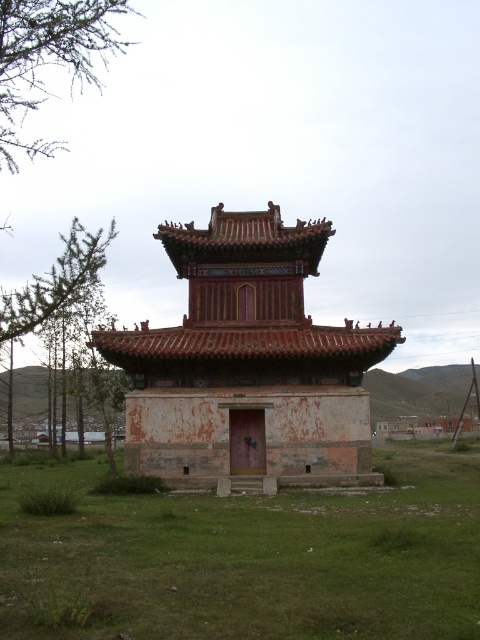
Question: Which object is farther from the camera taking this photo?

Choices:
 (A) green leafy tree at left
 (B) green leafy tree at upper left

Answer: (A)

Question: Which point is closer to the camera?

Choices:
 (A) green leafy tree at upper left
 (B) rusty wood pagoda at center
 (C) green leafy tree at left

Answer: (A)

Question: Is green grass at center thinner than rusty wood pagoda at center?

Choices:
 (A) yes
 (B) no

Answer: (B)

Question: Is green grass at center wider than green leafy tree at upper left?

Choices:
 (A) no
 (B) yes

Answer: (A)

Question: Which object appears farthest from the camera in this image?

Choices:
 (A) green leafy tree at left
 (B) green grass at center
 (C) rusty wood pagoda at center

Answer: (C)

Question: Is green grass at center smaller than rusty wood pagoda at center?

Choices:
 (A) no
 (B) yes

Answer: (A)